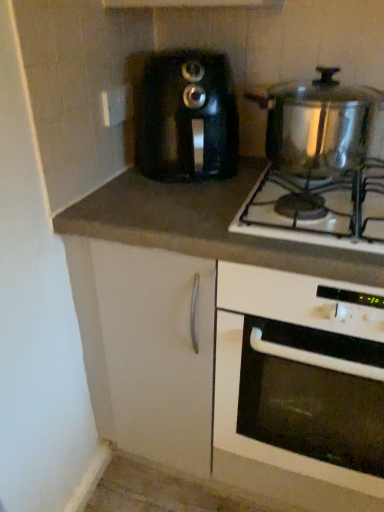
Question: Relative to black plastic toaster at center, is white glossy oven at center in front or behind?

Choices:
 (A) front
 (B) behind

Answer: (A)

Question: In terms of height, does white glossy oven at center look taller or shorter compared to black plastic toaster at center?

Choices:
 (A) short
 (B) tall

Answer: (B)

Question: Which is farther from the white plastic electric outlet at upper center?

Choices:
 (A) black plastic toaster at center
 (B) white glossy oven at center
 (C) dark gray laminate countertop at center
 (D) shiny metallic pot at upper right
 (E) shiny metallic pot at upper right

Answer: (B)

Question: Which object is positioned farthest from the black plastic toaster at center?

Choices:
 (A) shiny metallic pot at upper right
 (B) dark gray laminate countertop at center
 (C) white plastic electric outlet at upper center
 (D) shiny metallic pot at upper right
 (E) white glossy oven at center

Answer: (E)